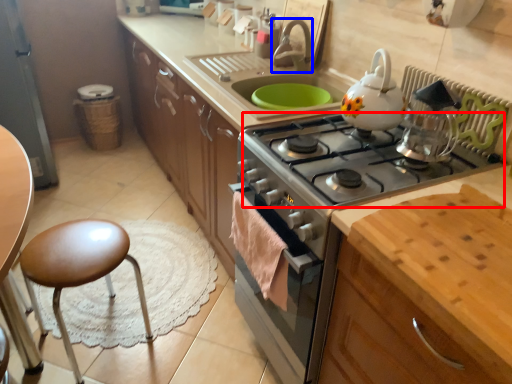
Question: Which object appears closest to the camera in this image, gas stove (highlighted by a red box) or faucet (highlighted by a blue box)?

Choices:
 (A) gas stove
 (B) faucet

Answer: (A)